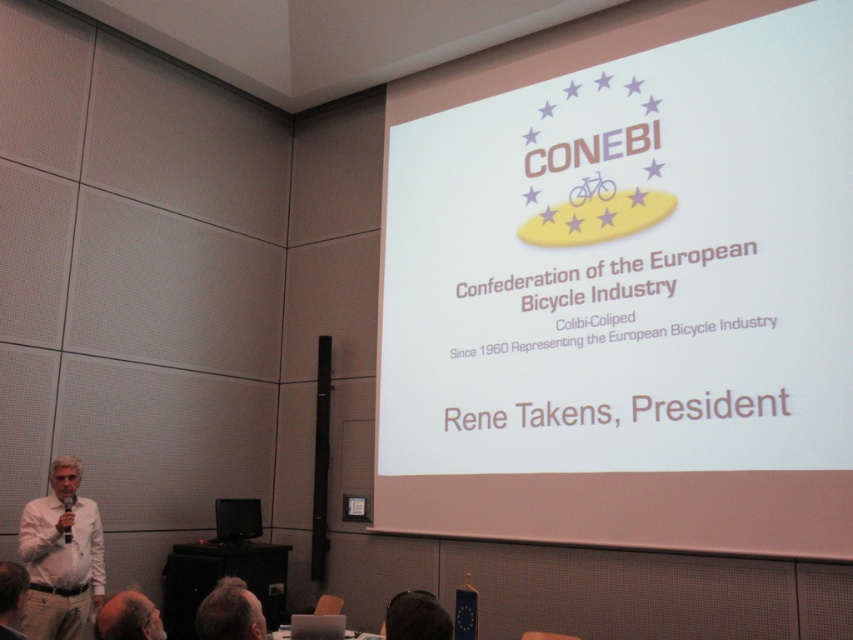
Based on the scene description, can you determine the spatial relationship between the white paper at upper center and the gray hair at lower left?

The white paper at upper center is located above the gray hair at lower left.

You are attending a conference and need to position two markers on the screen for a presentation. The first marker should be placed at point (25, 516) and the second at point (234, 618). From the audience perspective, which marker will appear closer to the front of the screen?

Point (234, 618) will appear closer to the front of the screen because point (25, 516) is behind it.